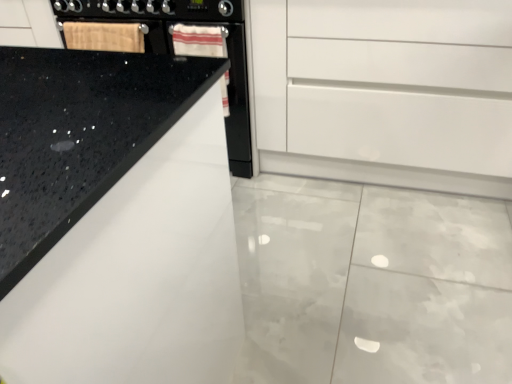
Question: Considering the positions of white glossy cabinet at center and black granite countertop at upper left in the image, is white glossy cabinet at center wider or thinner than black granite countertop at upper left?

Choices:
 (A) wide
 (B) thin

Answer: (B)

Question: Is white glossy cabinet at center in front of or behind black granite countertop at upper left in the image?

Choices:
 (A) front
 (B) behind

Answer: (B)

Question: Which is farther from the white glossy cabinet at center?

Choices:
 (A) black granite countertop at upper left
 (B) wooden cutting board at upper left

Answer: (A)

Question: Estimate the real-world distances between objects in this image. Which object is closer to the black granite countertop at upper left?

Choices:
 (A) wooden cutting board at upper left
 (B) white glossy cabinet at center

Answer: (A)